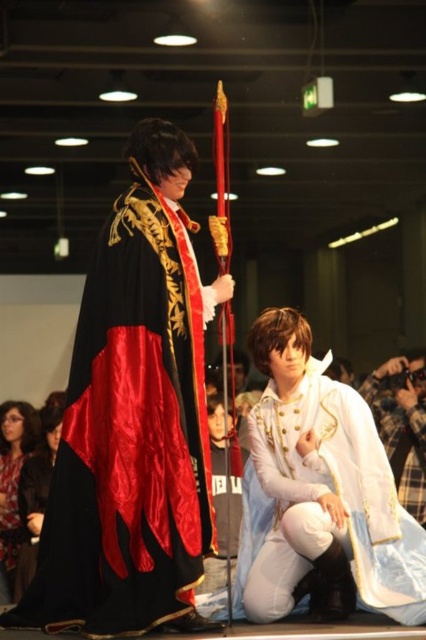
Is white satin dress at lower right closer to camera compared to satin black dress at lower left?

Yes, it is in front of satin black dress at lower left.

Can you confirm if white satin dress at lower right is positioned below satin black dress at lower left?

Actually, white satin dress at lower right is above satin black dress at lower left.

Between point (412, 392) and point (22, 467), which one is positioned behind?

The point (412, 392) is more distant.

Where is `white satin dress at lower right`? white satin dress at lower right is located at coordinates (402, 422).

Does satin/black cape at center have a lesser width compared to white satin coat at lower right?

In fact, satin/black cape at center might be wider than white satin coat at lower right.

Where is `satin/black cape at center`? The width and height of the screenshot is (426, 640). satin/black cape at center is located at coordinates (129, 436).

Is point (187, 346) closer to camera compared to point (365, 432)?

Yes.

Where is `satin/black cape at center`? The image size is (426, 640). satin/black cape at center is located at coordinates (129, 436).

Is white satin coat at lower right to the right of white satin dress at lower right from the viewer's perspective?

In fact, white satin coat at lower right is to the left of white satin dress at lower right.

Does white satin coat at lower right have a lesser height compared to white satin dress at lower right?

In fact, white satin coat at lower right may be taller than white satin dress at lower right.

The width and height of the screenshot is (426, 640). Describe the element at coordinates (319, 506) in the screenshot. I see `white satin coat at lower right` at that location.

The image size is (426, 640). I want to click on white satin coat at lower right, so click(x=319, y=506).